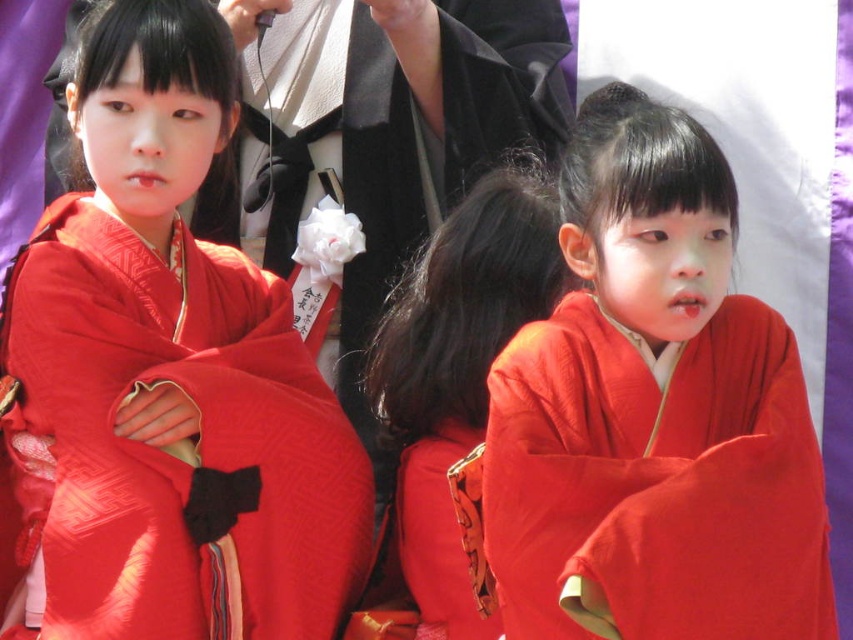
Does matte kimono at center appear on the right side of matte red kimono at center?

In fact, matte kimono at center is to the left of matte red kimono at center.

From the picture: Does matte kimono at center come in front of matte red kimono at center?

No, it is not.

Describe the element at coordinates (170, 374) in the screenshot. I see `matte kimono at center` at that location.

At what (x,y) coordinates should I click in order to perform the action: click on matte kimono at center. Please return your answer as a coordinate pair (x, y). This screenshot has width=853, height=640. Looking at the image, I should click on (170, 374).

Does matte kimono at center appear over silky red kimono at center?

Indeed, matte kimono at center is positioned over silky red kimono at center.

Does point (56, 540) come closer to viewer compared to point (471, 228)?

That is True.

Identify the location of matte kimono at center. The image size is (853, 640). (170, 374).

In the scene shown: Is matte red kimono at center shorter than silky red kimono at center?

No, matte red kimono at center is not shorter than silky red kimono at center.

Which is above, matte red kimono at center or silky red kimono at center?

matte red kimono at center

Who is more distant from viewer, [689,424] or [456,564]?

The point [456,564] is more distant.

Where is `matte red kimono at center`? The height and width of the screenshot is (640, 853). matte red kimono at center is located at coordinates (653, 413).